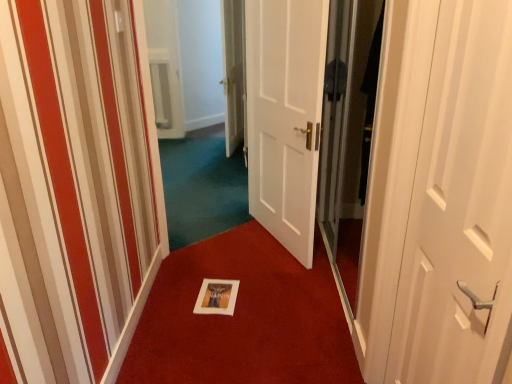
Question: Considering the relative positions of white glossy door at center, which is counted as the third door, starting from the right, and white matte door at center, which appears as the 2th door when viewed from the left, in the image provided, is white glossy door at center, which is counted as the third door, starting from the right, to the left of white matte door at center, which appears as the 2th door when viewed from the left, from the viewer's perspective?

Choices:
 (A) yes
 (B) no

Answer: (A)

Question: From a real-world perspective, does white glossy door at center, which is the 1th door in back-to-front order, stand above white matte door at center, which appears as the 2th door when viewed from the left?

Choices:
 (A) no
 (B) yes

Answer: (B)

Question: From a real-world perspective, is white glossy door at center, which ranks as the 1th door in left-to-right order, below white matte door at center, which appears as the 2th door when viewed from the left?

Choices:
 (A) yes
 (B) no

Answer: (B)

Question: From the image's perspective, is white glossy door at center, which ranks as the 1th door in left-to-right order, on top of white matte door at center, which appears as the 2th door when viewed from the left?

Choices:
 (A) yes
 (B) no

Answer: (A)

Question: Is white matte door at center, the 2th door when ordered from back to front, inside white glossy door at center, which is counted as the third door, starting from the right?

Choices:
 (A) no
 (B) yes

Answer: (A)

Question: Does white glossy door at center, which ranks as the 1th door in left-to-right order, have a smaller size compared to white matte door at center, placed as the second door when sorted from front to back?

Choices:
 (A) yes
 (B) no

Answer: (B)

Question: Is white paper at center facing towards transparent glass screen door at right?

Choices:
 (A) yes
 (B) no

Answer: (B)

Question: Can you see white paper at center touching transparent glass screen door at right?

Choices:
 (A) no
 (B) yes

Answer: (A)

Question: Does white paper at center have a lesser height compared to transparent glass screen door at right?

Choices:
 (A) no
 (B) yes

Answer: (B)

Question: Is white paper at center thinner than transparent glass screen door at right?

Choices:
 (A) yes
 (B) no

Answer: (B)

Question: Is white paper at center positioned with its back to transparent glass screen door at right?

Choices:
 (A) no
 (B) yes

Answer: (A)

Question: Is white paper at center taller than transparent glass screen door at right?

Choices:
 (A) yes
 (B) no

Answer: (B)

Question: Could white glossy door at center, which ranks as the 1th door in left-to-right order, be considered to be inside white paper at center?

Choices:
 (A) no
 (B) yes

Answer: (A)